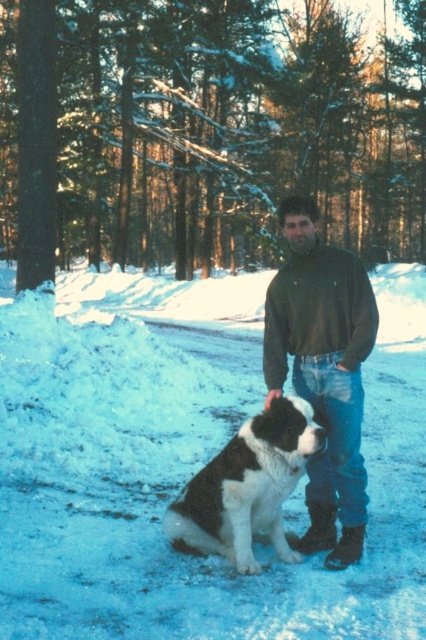
Question: Which of the following is the closest to the observer?

Choices:
 (A) (262, 451)
 (B) (204, 595)
 (C) (317, 458)

Answer: (B)

Question: Which object is positioned farthest from the black and white fur at center?

Choices:
 (A) dark green sweater at center
 (B) white fluffy snow at center

Answer: (B)

Question: Does dark green sweater at center come behind black and white fur at center?

Choices:
 (A) no
 (B) yes

Answer: (B)

Question: Which point appears closest to the camera in this image?

Choices:
 (A) (189, 552)
 (B) (48, 552)
 (C) (290, 244)

Answer: (C)

Question: Is dark green sweater at center thinner than black and white fur at center?

Choices:
 (A) yes
 (B) no

Answer: (A)

Question: Considering the relative positions of dark green sweater at center and black and white fur at center in the image provided, where is dark green sweater at center located with respect to black and white fur at center?

Choices:
 (A) right
 (B) left

Answer: (A)